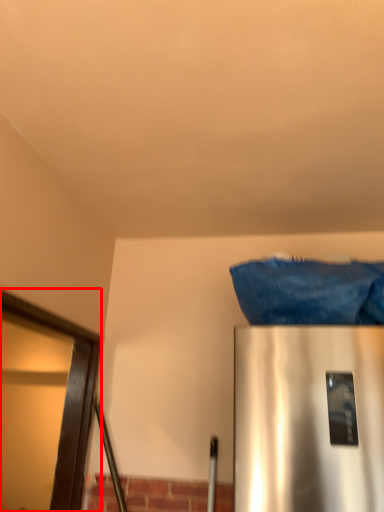
Question: Considering the relative positions of glass door (annotated by the red box) and material in the image provided, where is glass door (annotated by the red box) located with respect to the staircase?

Choices:
 (A) left
 (B) right

Answer: (A)